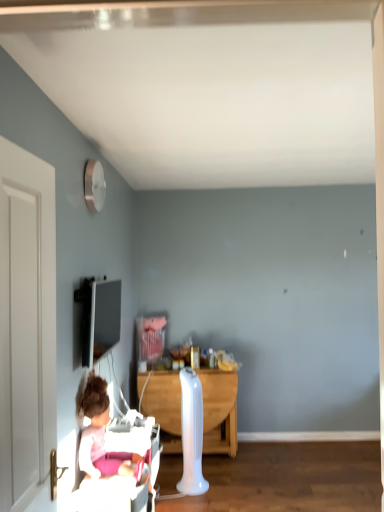
What is the approximate height of wooden desk at center?

76.12 centimeters.

Where is `white plastic radiator at center`? white plastic radiator at center is located at coordinates point(191,434).

This screenshot has width=384, height=512. Identify the location of white wooden door at left. (26, 323).

Consider the image. Is matte black tv at upper left facing towards white wooden door at left?

No, matte black tv at upper left is not facing towards white wooden door at left.

Measure the distance from matte black tv at upper left to white wooden door at left.

The distance of matte black tv at upper left from white wooden door at left is 2.37 meters.

Which object is positioned more to the left, matte black tv at upper left or white wooden door at left?

From the viewer's perspective, matte black tv at upper left appears more on the left side.

From the picture: How different are the orientations of matte black tv at upper left and white wooden door at left in degrees?

The angular difference between matte black tv at upper left and white wooden door at left is 2.25 degrees.

How far apart are pink fabric doll at lower left and white wooden door at left?

A distance of 35.71 inches exists between pink fabric doll at lower left and white wooden door at left.

From the image's perspective, is pink fabric doll at lower left located above white wooden door at left?

No, from the image's perspective, pink fabric doll at lower left is not over white wooden door at left.

Considering the relative positions of pink fabric doll at lower left and white wooden door at left in the image provided, is pink fabric doll at lower left to the right of white wooden door at left from the viewer's perspective?

Indeed, pink fabric doll at lower left is positioned on the right side of white wooden door at left.

Between pink fabric doll at lower left and white wooden door at left, which one is positioned in front?

white wooden door at left is closer to the camera.

Measure the distance from matte black tv at upper left to pink fabric doll at lower left.

matte black tv at upper left is 5.13 feet from pink fabric doll at lower left.

In terms of height, does matte black tv at upper left look taller or shorter compared to pink fabric doll at lower left?

matte black tv at upper left is shorter than pink fabric doll at lower left.

Considering the sizes of objects matte black tv at upper left and pink fabric doll at lower left in the image provided, who is thinner, matte black tv at upper left or pink fabric doll at lower left?

Thinner between the two is matte black tv at upper left.

Considering the relative positions of matte black tv at upper left and pink fabric doll at lower left in the image provided, is matte black tv at upper left to the left or to the right of pink fabric doll at lower left?

Clearly, matte black tv at upper left is on the left of pink fabric doll at lower left in the image.

Measure the distance between wooden desk at center and white wooden door at left.

They are 8.01 feet apart.

Is wooden desk at center oriented towards white wooden door at left?

Yes, wooden desk at center faces towards white wooden door at left.

Is wooden desk at center positioned beyond the bounds of white wooden door at left?

Yes, wooden desk at center is located beyond the bounds of white wooden door at left.

Between wooden desk at center and white wooden door at left, which one has smaller width?

Thinner between the two is white wooden door at left.

Is white plastic radiator at center bigger or smaller than white wooden door at left?

white plastic radiator at center is bigger than white wooden door at left.

Is white plastic radiator at center facing towards white wooden door at left?

No, white plastic radiator at center is not turned towards white wooden door at left.

The image size is (384, 512). What are the coordinates of `door that is above the white plastic radiator at center (from the image's perspective)` in the screenshot? It's located at (26, 323).

How many degrees apart are the facing directions of white plastic radiator at center and white wooden door at left?

The angle between the facing direction of white plastic radiator at center and the facing direction of white wooden door at left is 32.5 degrees.

Which of these two, white wooden door at left or white plastic radiator at center, is wider?

Wider between the two is white plastic radiator at center.

Identify the location of radiator behind the white wooden door at left. (191, 434).

What's the angular difference between white wooden door at left and white plastic radiator at center's facing directions?

32.5 degrees.

Measure the distance from white wooden door at left to white plastic radiator at center.

They are 2.04 meters apart.

Is point (108, 456) closer to camera compared to point (96, 311)?

Yes, it is.

Relative to matte black tv at upper left, is pink fabric doll at lower left in front or behind?

Visually, pink fabric doll at lower left is located in front of matte black tv at upper left.

Looking at this image, what's the angular difference between pink fabric doll at lower left and matte black tv at upper left's facing directions?

They differ by 0.116 degrees in their facing directions.

Can you confirm if pink fabric doll at lower left is shorter than matte black tv at upper left?

No.

Where is `door in front of the matte black tv at upper left`? The image size is (384, 512). door in front of the matte black tv at upper left is located at coordinates (x=26, y=323).

Identify the location of door on the left side of pink fabric doll at lower left. The image size is (384, 512). (26, 323).

Estimate the real-world distances between objects in this image. Which object is closer to white wooden door at left, matte black tv at upper left or wooden desk at center?

matte black tv at upper left is closer to white wooden door at left.

Considering their positions, is matte black tv at upper left positioned further to white plastic radiator at center than pink fabric doll at lower left?

matte black tv at upper left is further to white plastic radiator at center.

From the image, which object appears to be farther from pink fabric doll at lower left, white wooden door at left or matte black tv at upper left?

matte black tv at upper left is further to pink fabric doll at lower left.

Looking at the image, which one is located further to wooden desk at center, matte black tv at upper left or pink fabric doll at lower left?

pink fabric doll at lower left.

When comparing their distances from wooden desk at center, does matte black tv at upper left or white wooden door at left seem closer?

The object closer to wooden desk at center is matte black tv at upper left.

From the image, which object appears to be nearer to white wooden door at left, white plastic radiator at center or pink fabric doll at lower left?

Based on the image, pink fabric doll at lower left appears to be nearer to white wooden door at left.

Estimate the real-world distances between objects in this image. Which object is further from pink fabric doll at lower left, wooden desk at center or matte black tv at upper left?

Among the two, matte black tv at upper left is located further to pink fabric doll at lower left.

Looking at this image, which object lies further to the anchor point wooden desk at center, pink fabric doll at lower left or white plastic radiator at center?

pink fabric doll at lower left is positioned further to the anchor wooden desk at center.

This screenshot has height=512, width=384. What are the coordinates of `radiator between white wooden door at left and wooden desk at center from front to back` in the screenshot? It's located at (191, 434).

Locate an element on the screen. Image resolution: width=384 pixels, height=512 pixels. person positioned between white wooden door at left and matte black tv at upper left from near to far is located at coordinates (100, 433).

Locate an element on the screen. television between pink fabric doll at lower left and white plastic radiator at center along the z-axis is located at coordinates click(x=100, y=318).

The height and width of the screenshot is (512, 384). Find the location of `television positioned between white wooden door at left and white plastic radiator at center from near to far`. television positioned between white wooden door at left and white plastic radiator at center from near to far is located at coordinates (100, 318).